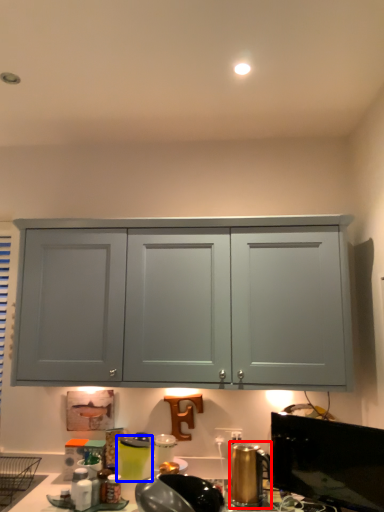
Question: Which object is closer to the camera taking this photo, appliance (highlighted by a red box) or appliance (highlighted by a blue box)?

Choices:
 (A) appliance
 (B) appliance

Answer: (A)